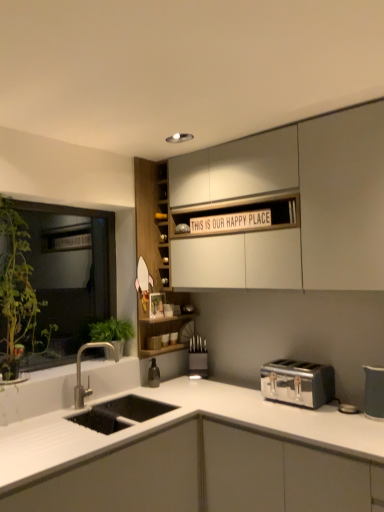
Question: From a real-world perspective, is metallic knife block at center, which is counted as the 2th appliance, starting from the right, physically located above or below green leafy plant at left?

Choices:
 (A) below
 (B) above

Answer: (A)

Question: Looking at their shapes, would you say metallic knife block at center, the second appliance when ordered from front to back, is wider or thinner than green leafy plant at left?

Choices:
 (A) thin
 (B) wide

Answer: (B)

Question: Considering the real-world distances, which object is closest to the satin nickel faucet at lower left?

Choices:
 (A) white matte countertop at lower left, which appears as the third cabinetry when viewed from the top
 (B) matte gray pitcher at right, which ranks as the first appliance in right-to-left order
 (C) satin chrome toaster at lower right
 (D) green leafy plant at left
 (E) metallic knife block at center, which is counted as the 2th appliance, starting from the right

Answer: (E)

Question: Which is farther from the white matte cabinet at upper center, positioned as the third cabinetry in bottom-to-top order?

Choices:
 (A) matte gray pitcher at right, which ranks as the first appliance in right-to-left order
 (B) satin nickel faucet at lower left
 (C) green leafy plant at left
 (D) white matte countertop at lower left, which appears as the third cabinetry when viewed from the top
 (E) wooden cabinet at center, the second cabinetry viewed from the top

Answer: (B)